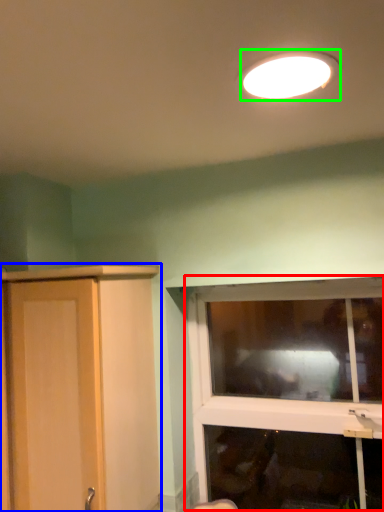
Question: Which object is the closest to the window (highlighted by a red box)? Choose among these: cupboard (highlighted by a blue box) or lamp (highlighted by a green box).

Choices:
 (A) cupboard
 (B) lamp

Answer: (A)